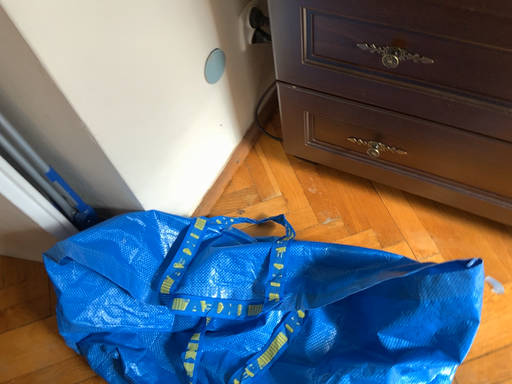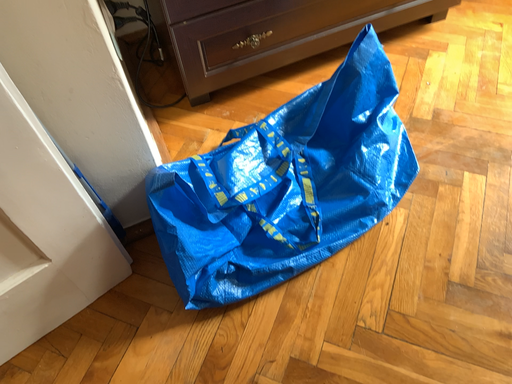
Question: Which way did the camera rotate in the video?

Choices:
 (A) rotated right
 (B) rotated left

Answer: (A)